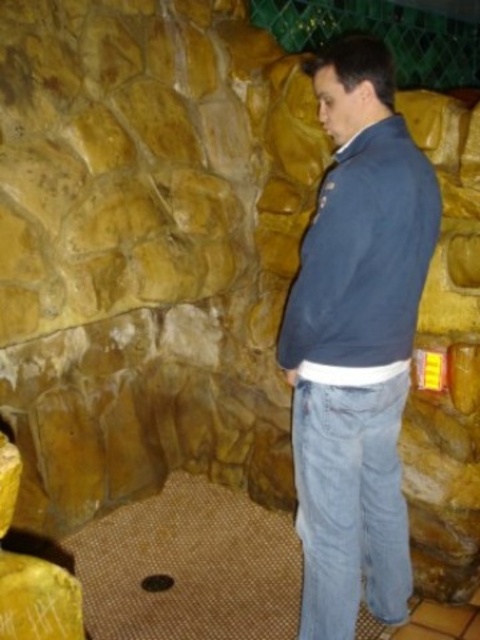
Does blue denim jeans at center appear over blue fleece sweatshirt at right?

No, blue denim jeans at center is not above blue fleece sweatshirt at right.

Is blue denim jeans at center smaller than blue fleece sweatshirt at right?

Actually, blue denim jeans at center might be larger than blue fleece sweatshirt at right.

This screenshot has height=640, width=480. Identify the location of blue denim jeans at center. (357, 342).

This screenshot has height=640, width=480. Find the location of `blue denim jeans at center`. blue denim jeans at center is located at coordinates (357, 342).